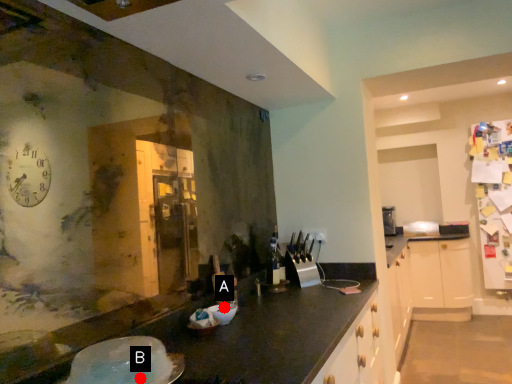
Question: Two points are circled on the image, labeled by A and B beside each circle. Which point is further to the camera?

Choices:
 (A) A is further
 (B) B is further

Answer: (A)